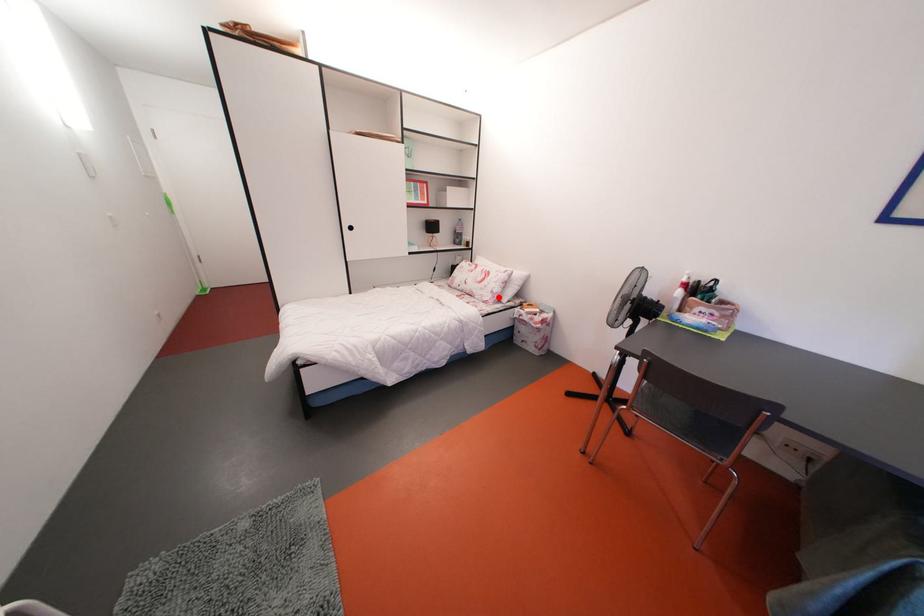
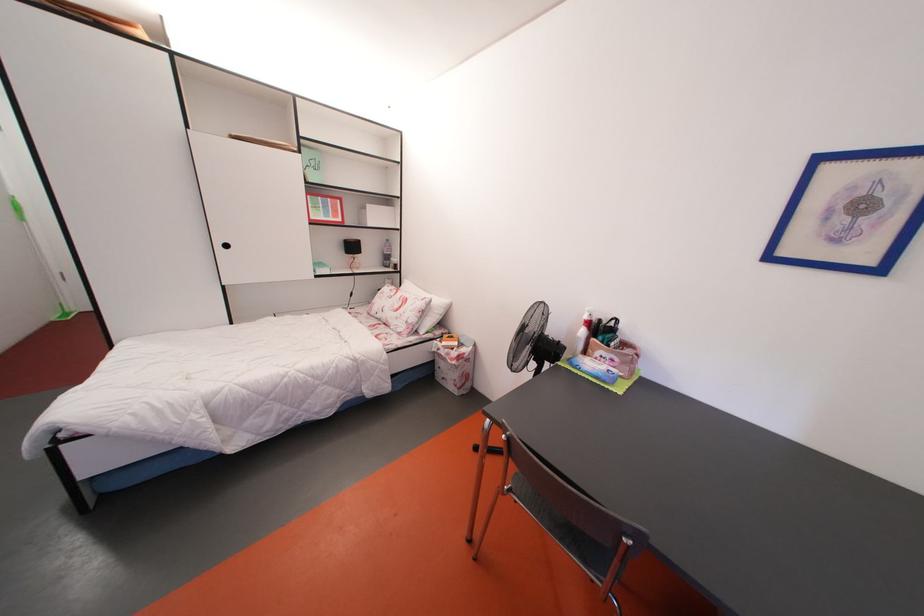
The point at the highlighted location is marked in the first image. Where is the corresponding point in the second image?

(414, 328)